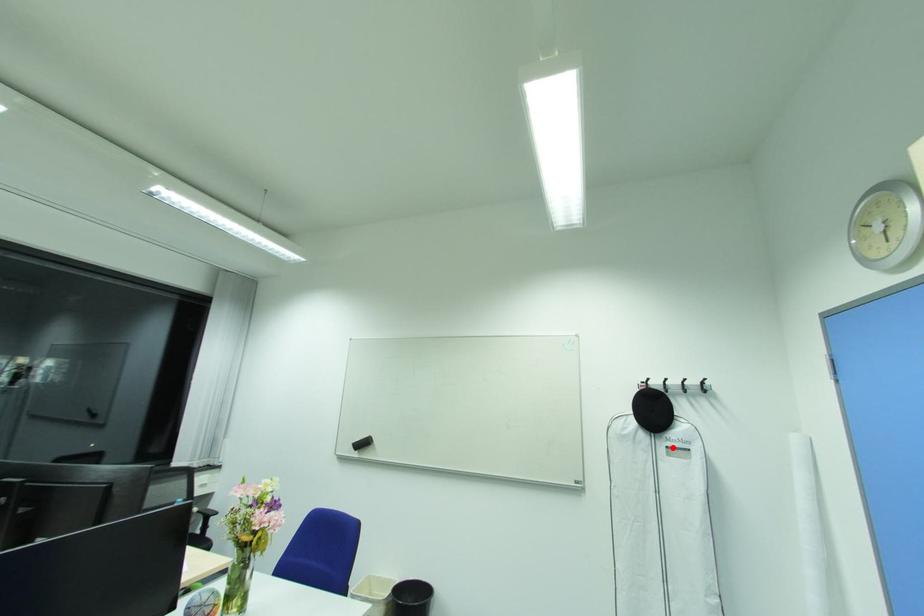
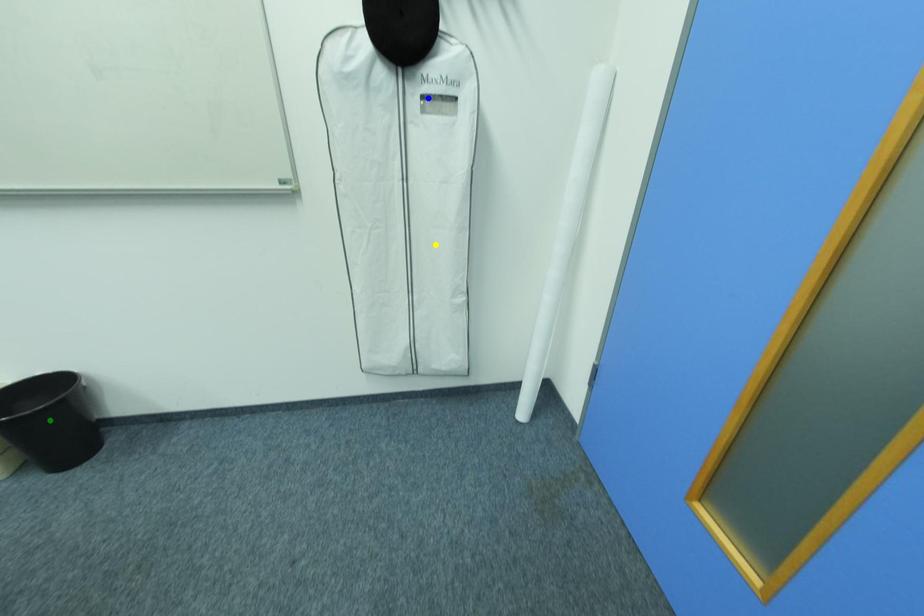
Question: I am providing you with two images of the same scene from different viewpoints. A red point is marked on the first image. You are given multiple points on the second image. Can you choose the point in image 2 that corresponds to the point in image 1?

Choices:
 (A) green point
 (B) yellow point
 (C) blue point

Answer: (C)